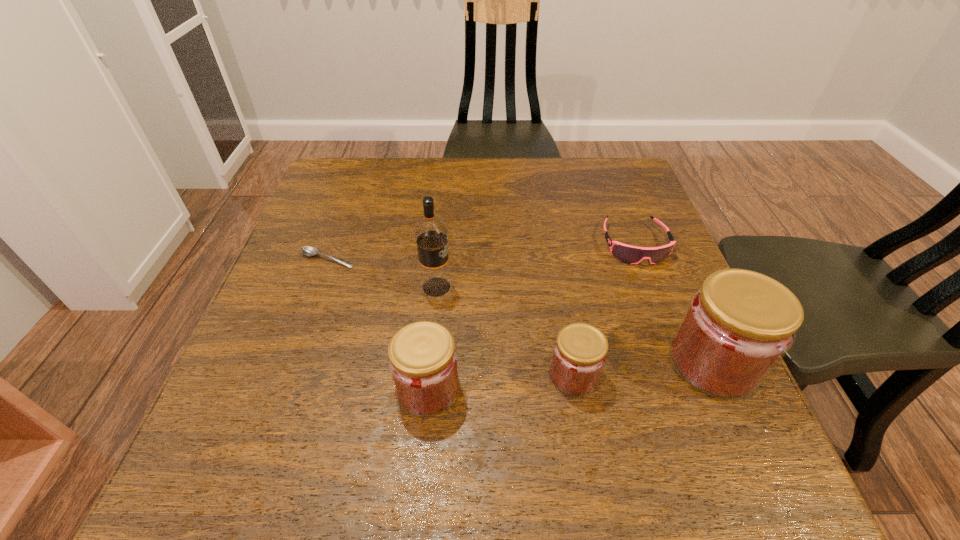
Where is `object at the near right corner`? The height and width of the screenshot is (540, 960). object at the near right corner is located at coordinates (739, 324).

Find the location of a particular element. The width and height of the screenshot is (960, 540). free space at the far edge of the desktop is located at coordinates (536, 167).

You are a GUI agent. You are given a task and a screenshot of the screen. Output one action in this format:
    pyautogui.click(x=<x>, y=<y>)
    Task: Click on the vacant space at the near edge
    The image size is (960, 540).
    Given the screenshot: What is the action you would take?
    pyautogui.click(x=642, y=407)

This screenshot has height=540, width=960. Identify the location of vacant space at the left edge. (351, 251).

Where is `free space at the right edge of the desktop`? This screenshot has width=960, height=540. free space at the right edge of the desktop is located at coordinates (630, 228).

You are a GUI agent. You are given a task and a screenshot of the screen. Output one action in this format:
    pyautogui.click(x=<x>, y=<y>)
    Task: Click on the free space at the far left corner
    
    Given the screenshot: What is the action you would take?
    pyautogui.click(x=371, y=178)

Find the location of a particular element. vacant space at the far right corner is located at coordinates (628, 176).

This screenshot has width=960, height=540. Identify the location of free spot between the goggles and the rightmost jam. (674, 303).

Where is `free space between the leftmost jam and the soupspoon`? free space between the leftmost jam and the soupspoon is located at coordinates (378, 323).

Identify the location of free area in between the third object from right to left and the third farthest object. (505, 331).